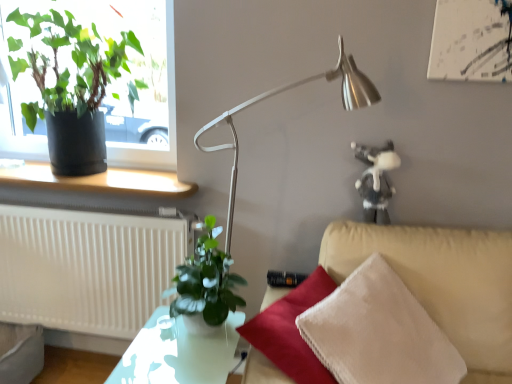
Describe the element at coordinates (286, 90) in the screenshot. I see `satin silver lamp at center` at that location.

Describe the element at coordinates (100, 181) in the screenshot. The height and width of the screenshot is (384, 512). I see `matte black window sill at lower left` at that location.

At what (x,y) coordinates should I click in order to perform the action: click on green matte plant at center, the second houseplant viewed from the top. Please return your answer as a coordinate pair (x, y). This screenshot has height=384, width=512. Looking at the image, I should click on (205, 283).

At what (x,y) coordinates should I click in order to perform the action: click on translucent glass table at center. Please return your answer as a coordinate pair (x, y). The image size is (512, 384). Looking at the image, I should click on (177, 353).

At what (x,y) coordinates should I click in order to perform the action: click on white textured radiator at lower left. Please return your answer as a coordinate pair (x, y). Image resolution: width=512 pixels, height=384 pixels. Looking at the image, I should click on (86, 268).

At what (x,y) coordinates should I click in order to perform the action: click on satin silver lamp at center. Please return your answer as a coordinate pair (x, y). This screenshot has height=384, width=512. Looking at the image, I should click on (286, 90).

Can you confirm if translucent glass table at center is positioned to the right of white textured radiator at lower left?

Indeed, translucent glass table at center is positioned on the right side of white textured radiator at lower left.

Is point (158, 351) positioned before point (48, 230)?

That is True.

Is translucent glass table at center not inside white textured radiator at lower left?

translucent glass table at center lies outside white textured radiator at lower left's area.

From a real-world perspective, is translucent glass table at center above or below white textured radiator at lower left?

Clearly, from a real-world perspective, translucent glass table at center is below white textured radiator at lower left.

This screenshot has height=384, width=512. I want to click on the 1st houseplant above the white textured radiator at lower left (from the image's perspective), so click(205, 283).

Considering the relative sizes of white textured radiator at lower left and green matte plant at center, which is counted as the 1th houseplant, starting from the bottom, in the image provided, is white textured radiator at lower left taller than green matte plant at center, which is counted as the 1th houseplant, starting from the bottom,?

Correct, white textured radiator at lower left is much taller as green matte plant at center, which is counted as the 1th houseplant, starting from the bottom.

Is point (133, 299) closer or farther from the camera than point (210, 312)?

Point (133, 299) appears to be farther away from the viewer than point (210, 312).

Would you say white textured radiator at lower left is outside green matte plant at center, which is counted as the second houseplant, starting from the back?

Yes, white textured radiator at lower left is outside of green matte plant at center, which is counted as the second houseplant, starting from the back.

Looking at this image, from the image's perspective, is white textured radiator at lower left located above matte black window sill at lower left?

No, from the image's perspective, white textured radiator at lower left is not above matte black window sill at lower left.

Is white textured radiator at lower left not within matte black window sill at lower left?

Yes, white textured radiator at lower left is outside of matte black window sill at lower left.

Looking at their sizes, would you say white textured radiator at lower left is wider or thinner than matte black window sill at lower left?

Considering their sizes, white textured radiator at lower left looks slimmer than matte black window sill at lower left.

Consider the image. Is white textured radiator at lower left not close to matte black window sill at lower left?

white textured radiator at lower left is near matte black window sill at lower left, not far away.

Looking at this image, is translucent glass table at center positioned before satin silver lamp at center?

Yes, translucent glass table at center is closer to the viewer.

Can you see translucent glass table at center touching satin silver lamp at center?

translucent glass table at center is not next to satin silver lamp at center, and they're not touching.

Between point (178, 318) and point (236, 137), which one is positioned in front?

Positioned in front is point (178, 318).

Consider the image. Is satin silver lamp at center next to green matte plant at center, the second houseplant viewed from the top, and touching it?

They are not placed beside each other.

From the picture: Based on their positions, is satin silver lamp at center located to the left or right of green matte plant at center, which appears as the second houseplant when viewed from the left?

In the image, satin silver lamp at center appears on the right side of green matte plant at center, which appears as the second houseplant when viewed from the left.

Which is correct: satin silver lamp at center is inside green matte plant at center, the second houseplant viewed from the top, or outside of it?

satin silver lamp at center lies outside green matte plant at center, the second houseplant viewed from the top.

In order to click on houseplant that appears in front of the satin silver lamp at center in this screenshot , I will do `click(205, 283)`.

Where is `table directly beneath the green matte plant at center, which is counted as the second houseplant, starting from the back (from a real-world perspective)`? The image size is (512, 384). table directly beneath the green matte plant at center, which is counted as the second houseplant, starting from the back (from a real-world perspective) is located at coordinates (177, 353).

Considering the sizes of objects green matte plant at center, which is counted as the second houseplant, starting from the back, and translucent glass table at center in the image provided, who is wider, green matte plant at center, which is counted as the second houseplant, starting from the back, or translucent glass table at center?

With larger width is translucent glass table at center.

Does green matte plant at center, positioned as the first houseplant in front-to-back order, come behind translucent glass table at center?

Yes.

Could you tell me if green matte plant at center, which is counted as the second houseplant, starting from the back, is turned towards satin silver lamp at center?

No.

Which object is positioned more to the left, green matte plant at center, positioned as the first houseplant in front-to-back order, or satin silver lamp at center?

From the viewer's perspective, green matte plant at center, positioned as the first houseplant in front-to-back order, appears more on the left side.

Is green matte plant at center, positioned as the first houseplant in front-to-back order, located outside satin silver lamp at center?

green matte plant at center, positioned as the first houseplant in front-to-back order, lies outside satin silver lamp at center's area.

Locate an element on the screen. Image resolution: width=512 pixels, height=384 pixels. radiator that appears above the translucent glass table at center (from the image's perspective) is located at coordinates (86, 268).

You are a GUI agent. You are given a task and a screenshot of the screen. Output one action in this format:
    pyautogui.click(x=<x>, y=<y>)
    Task: Click on the radiator to the left of green matte plant at center, which is counted as the first houseplant, starting from the right
    Image resolution: width=512 pixels, height=384 pixels.
    Given the screenshot: What is the action you would take?
    pyautogui.click(x=86, y=268)

From the image, which object appears to be farther from white textured radiator at lower left, green matte plant at upper left, the second houseplant in the right-to-left sequence, or translucent glass table at center?

translucent glass table at center is positioned further to the anchor white textured radiator at lower left.

Looking at the image, which one is located closer to green matte plant at center, the second houseplant viewed from the top, white textured radiator at lower left or matte black window sill at lower left?

matte black window sill at lower left.

When comparing their distances from white textured radiator at lower left, does satin silver lamp at center or green matte plant at upper left, marked as the first houseplant in a back-to-front arrangement, seem closer?

green matte plant at upper left, marked as the first houseplant in a back-to-front arrangement, is closer to white textured radiator at lower left.

Which object lies further to the anchor point green matte plant at center, the second houseplant viewed from the top, translucent glass table at center or satin silver lamp at center?

The object further to green matte plant at center, the second houseplant viewed from the top, is satin silver lamp at center.

Looking at the image, which one is located further to white textured radiator at lower left, green matte plant at upper left, which ranks as the second houseplant in bottom-to-top order, or matte black window sill at lower left?

Based on the image, green matte plant at upper left, which ranks as the second houseplant in bottom-to-top order, appears to be further to white textured radiator at lower left.

Looking at the image, which one is located further to translucent glass table at center, white textured radiator at lower left or green matte plant at upper left, which ranks as the first houseplant in top-to-bottom order?

The object further to translucent glass table at center is green matte plant at upper left, which ranks as the first houseplant in top-to-bottom order.

Estimate the real-world distances between objects in this image. Which object is closer to translucent glass table at center, green matte plant at center, which is counted as the first houseplant, starting from the right, or matte black window sill at lower left?

green matte plant at center, which is counted as the first houseplant, starting from the right, is positioned closer to the anchor translucent glass table at center.

Estimate the real-world distances between objects in this image. Which object is closer to white textured radiator at lower left, satin silver lamp at center or matte black window sill at lower left?

Among the two, matte black window sill at lower left is located nearer to white textured radiator at lower left.

Identify the location of radiator between green matte plant at upper left, marked as the first houseplant in a back-to-front arrangement, and translucent glass table at center vertically. (86, 268).

Where is `houseplant between satin silver lamp at center and translucent glass table at center from top to bottom`? The height and width of the screenshot is (384, 512). houseplant between satin silver lamp at center and translucent glass table at center from top to bottom is located at coordinates (205, 283).

Where is `lamp between green matte plant at upper left, which is the first houseplant from left to right, and translucent glass table at center, in the vertical direction`? This screenshot has width=512, height=384. lamp between green matte plant at upper left, which is the first houseplant from left to right, and translucent glass table at center, in the vertical direction is located at coordinates (286, 90).

Where is `table between white textured radiator at lower left and satin silver lamp at center in the horizontal direction`? The width and height of the screenshot is (512, 384). table between white textured radiator at lower left and satin silver lamp at center in the horizontal direction is located at coordinates (177, 353).